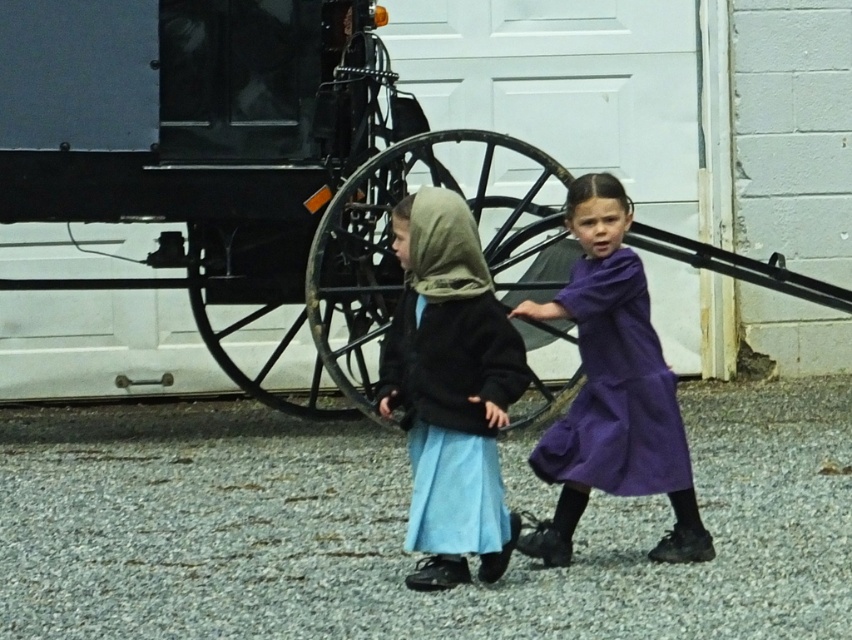
Question: Which point is farther to the camera?

Choices:
 (A) (510, 120)
 (B) (563, 467)

Answer: (A)

Question: Among these objects, which one is nearest to the camera?

Choices:
 (A) matte black jacket at center
 (B) purple matte dress at center

Answer: (A)

Question: Which object appears closest to the camera in this image?

Choices:
 (A) purple matte dress at center
 (B) black matte horse cart at center
 (C) matte black jacket at center

Answer: (C)

Question: Can you confirm if matte black jacket at center is thinner than purple matte dress at center?

Choices:
 (A) no
 (B) yes

Answer: (B)

Question: Is black matte horse cart at center to the right of purple matte dress at center from the viewer's perspective?

Choices:
 (A) yes
 (B) no

Answer: (B)

Question: In this image, where is black matte horse cart at center located relative to matte black jacket at center?

Choices:
 (A) left
 (B) right

Answer: (A)